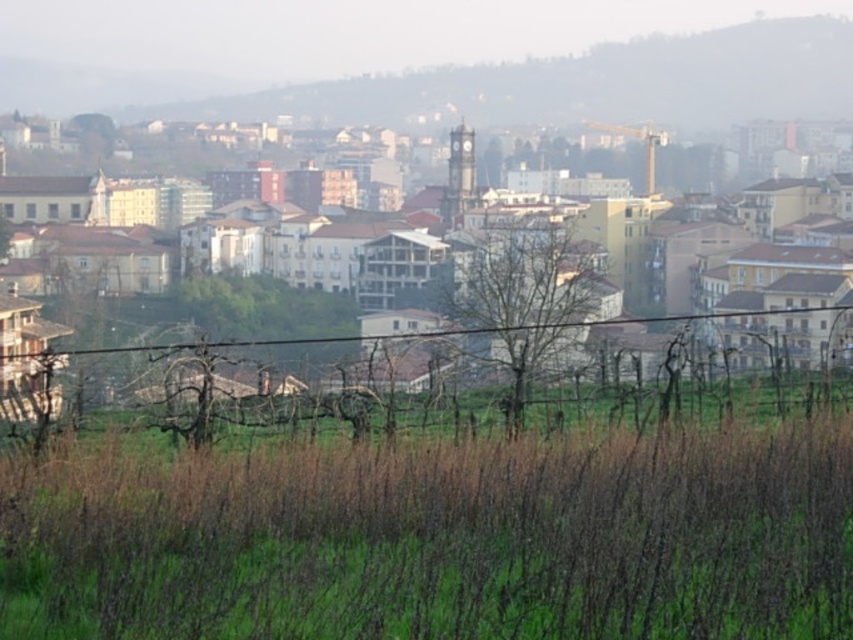
Question: Does brown textured buildings at center appear on the left side of brown wire fence at center?

Choices:
 (A) yes
 (B) no

Answer: (A)

Question: Which of the following is the closest to the observer?

Choices:
 (A) (273, 221)
 (B) (172, 580)
 (C) (44, 401)

Answer: (B)

Question: Which point appears closest to the camera in this image?

Choices:
 (A) (631, 292)
 (B) (587, 388)

Answer: (B)

Question: Is green grass at lower center further to camera compared to brown wire fence at center?

Choices:
 (A) yes
 (B) no

Answer: (B)

Question: Which of the following is the farthest from the observer?

Choices:
 (A) (270, 348)
 (B) (296, 228)
 (C) (537, 557)

Answer: (B)

Question: Can you confirm if brown textured buildings at center is smaller than brown wire fence at center?

Choices:
 (A) no
 (B) yes

Answer: (A)